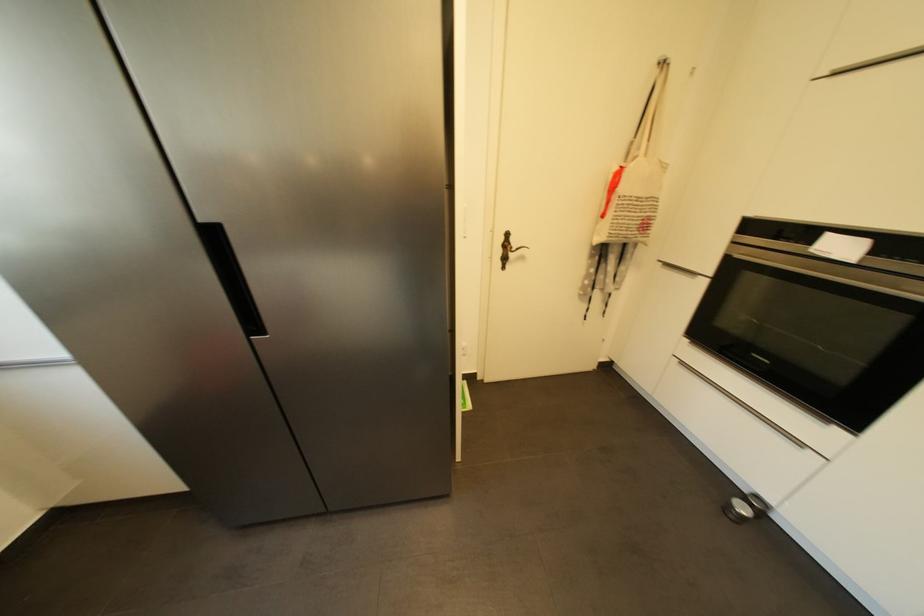
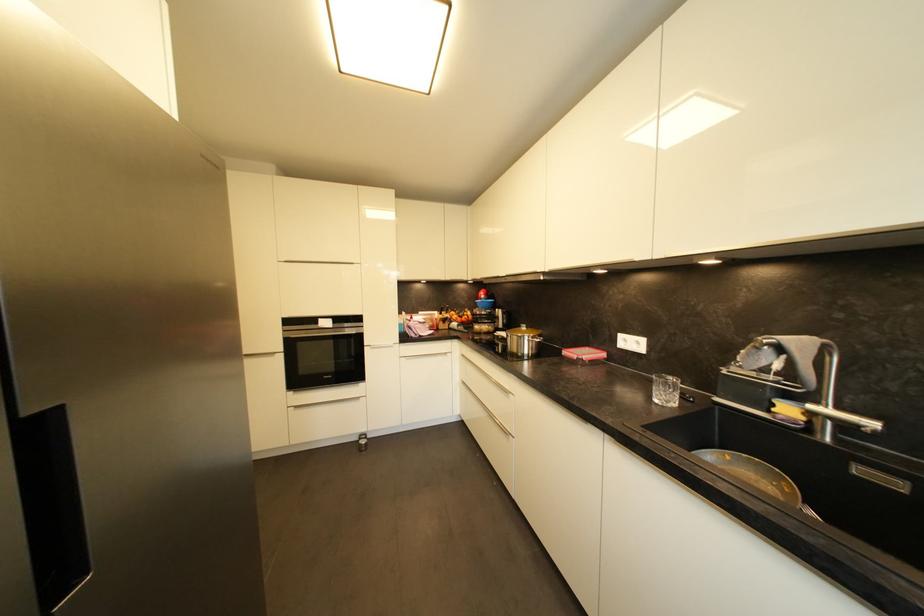
Find the pixel in the second image that matches (x=749, y=500) in the first image.

(365, 440)